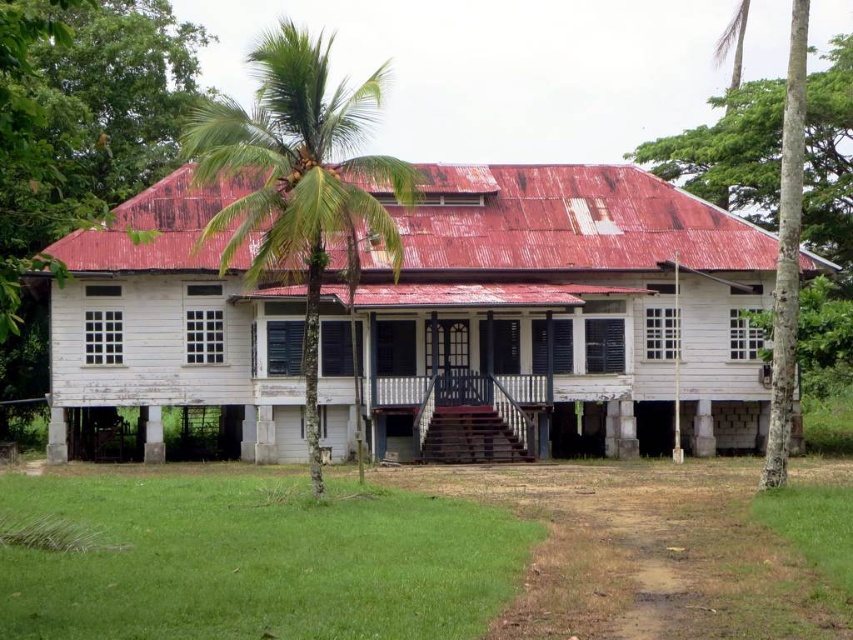
Based on the photo, is green leafy palm tree at center closer to the viewer compared to smooth bark palm tree at right?

Yes, it is.

Who is more forward, (351,234) or (846,161)?

Point (351,234) is more forward.

This screenshot has width=853, height=640. Find the location of `green leafy palm tree at center`. green leafy palm tree at center is located at coordinates (299, 180).

Between white wooden house at center and smooth bark palm tree at right, which one appears on the left side from the viewer's perspective?

Positioned to the left is white wooden house at center.

Which is behind, point (717, 426) or point (740, 150)?

Point (740, 150)

Does point (424, 291) come behind point (819, 182)?

That is False.

What are the coordinates of `white wooden house at center` in the screenshot? It's located at (575, 304).

Consider the image. Can you confirm if white wooden house at center is shorter than green leafy palm tree at center?

Yes.

Describe the element at coordinates (575, 304) in the screenshot. The height and width of the screenshot is (640, 853). I see `white wooden house at center` at that location.

Which is behind, point (668, 209) or point (323, 122)?

Positioned behind is point (668, 209).

I want to click on white wooden house at center, so click(x=575, y=304).